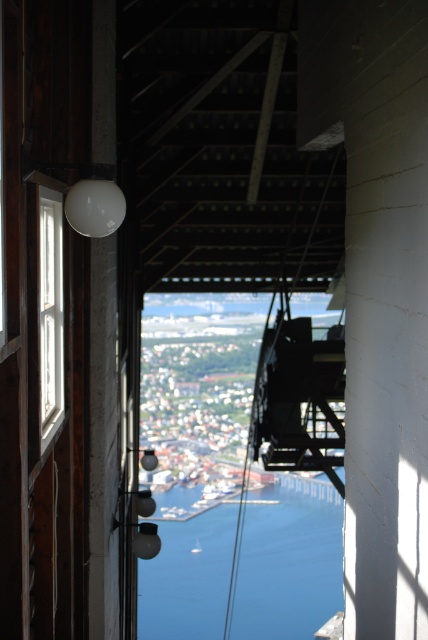
Locate an element on the screen. This screenshot has width=428, height=640. white wooden window at left is located at coordinates (50, 310).

Can you confirm if white wooden window at left is positioned to the left of white plastic boat at center?

No, white wooden window at left is not to the left of white plastic boat at center.

Describe the element at coordinates (50, 310) in the screenshot. I see `white wooden window at left` at that location.

Where is `white wooden window at left`? The height and width of the screenshot is (640, 428). white wooden window at left is located at coordinates (50, 310).

Between blue water at center and white wooden window at left, which one has less height?

Standing shorter between the two is white wooden window at left.

Who is lower down, blue water at center or white wooden window at left?

blue water at center

Identify the location of blue water at center. The width and height of the screenshot is (428, 640). (288, 561).

Which is more to the right, blue water at center or white plastic boat at center?

From the viewer's perspective, blue water at center appears more on the right side.

Who is higher up, blue water at center or white plastic boat at center?

white plastic boat at center is above.

Where is `blue water at center`? The image size is (428, 640). blue water at center is located at coordinates (288, 561).